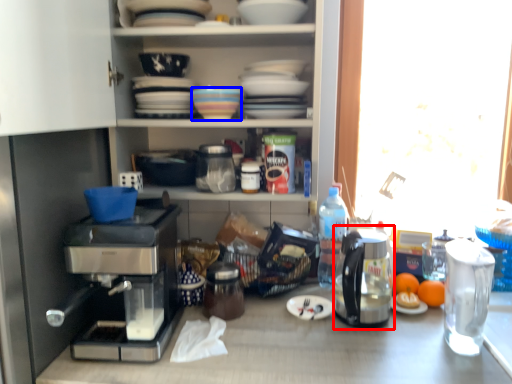
Question: Which point is further to the camera, coffeepot (highlighted by a red box) or tableware (highlighted by a blue box)?

Choices:
 (A) coffeepot
 (B) tableware

Answer: (B)